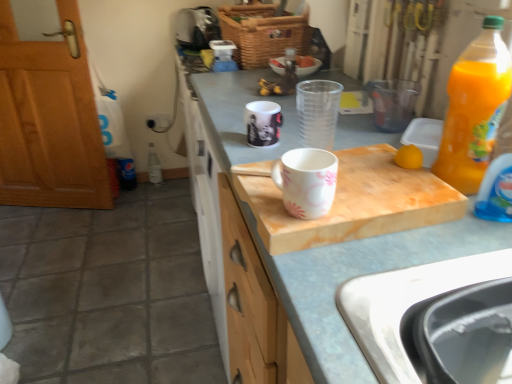
Question: Considering the positions of white marble cutting board at center and white glossy mug at center, the first coffee cup positioned from the top, in the image, is white marble cutting board at center wider or thinner than white glossy mug at center, the first coffee cup positioned from the top,?

Choices:
 (A) wide
 (B) thin

Answer: (A)

Question: Relative to white glossy mug at center, the first coffee cup positioned from the top, is white marble cutting board at center in front or behind?

Choices:
 (A) front
 (B) behind

Answer: (B)

Question: Based on their relative distances, which object is farther from the woven brown basket at upper center?

Choices:
 (A) white marble cutting board at center
 (B) white marble cutting board at center
 (C) white glossy mug at center, which is the 2th coffee cup from bottom to top
 (D) white glossy mug at center, which ranks as the 2th coffee cup in back-to-front order
 (E) translucent plastic bottle at center, which is the 1th bottle from back to front

Answer: (D)

Question: Based on their relative distances, which object is farther from the white marble cutting board at center?

Choices:
 (A) white marble cutting board at center
 (B) translucent plastic bottle at center, which is the 1th bottle from back to front
 (C) woven brown basket at upper center
 (D) black plastic sink at lower right
 (E) translucent plastic bottle at right, the 2th bottle from the back

Answer: (C)